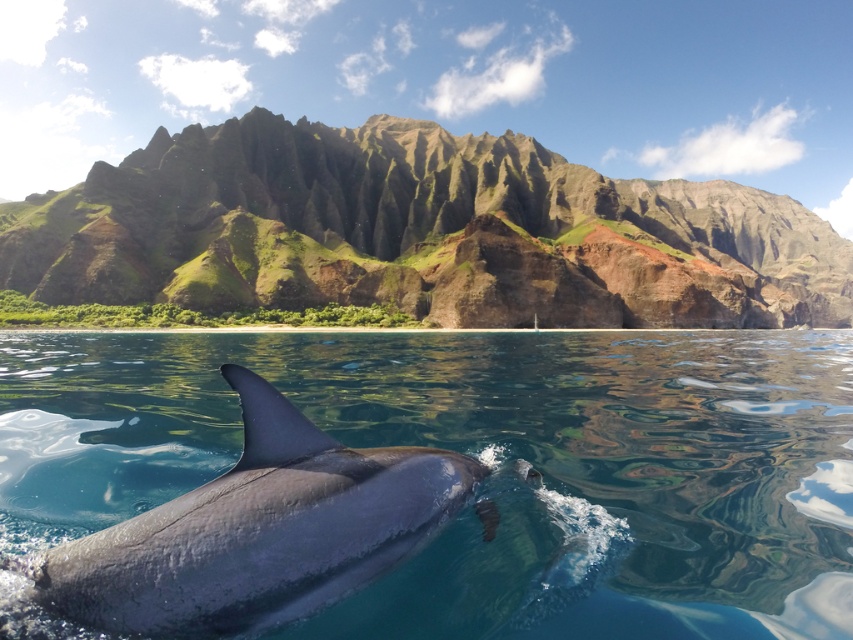
You are a photographer trying to capture the smooth gray dolphin at center and the gray matte fin at lower center in a single shot. Which object should you focus on first to ensure both are in sharp focus?

You should focus on the smooth gray dolphin at center first, as it is closer to the viewer than the gray matte fin at lower center. By focusing on the closer object, the farther one may still be in acceptable focus depending on the lens and aperture used.

You are a marine biologist observing the coastal scene. You notice the smooth gray dolphin at center and the gray matte fin at lower center. Which object is positioned lower in the image?

The smooth gray dolphin at center is positioned below the gray matte fin at lower center, so the smooth gray dolphin at center is lower in the image.